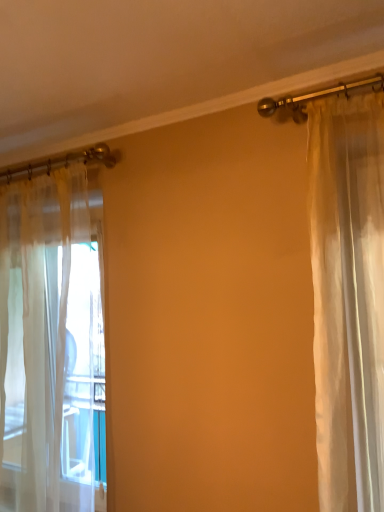
What is the approximate width of sheer white curtain at left?

sheer white curtain at left is 7.97 inches wide.

In order to face sheer white curtain at left, should I rotate leftwards or rightwards?

A 20.735 degree turn to the left will do.

Where is `sheer white curtain at left`? The height and width of the screenshot is (512, 384). sheer white curtain at left is located at coordinates pyautogui.click(x=49, y=343).

Describe the element at coordinates (49, 343) in the screenshot. I see `sheer white curtain at left` at that location.

Where is `sheer white curtain at left`? sheer white curtain at left is located at coordinates (49, 343).